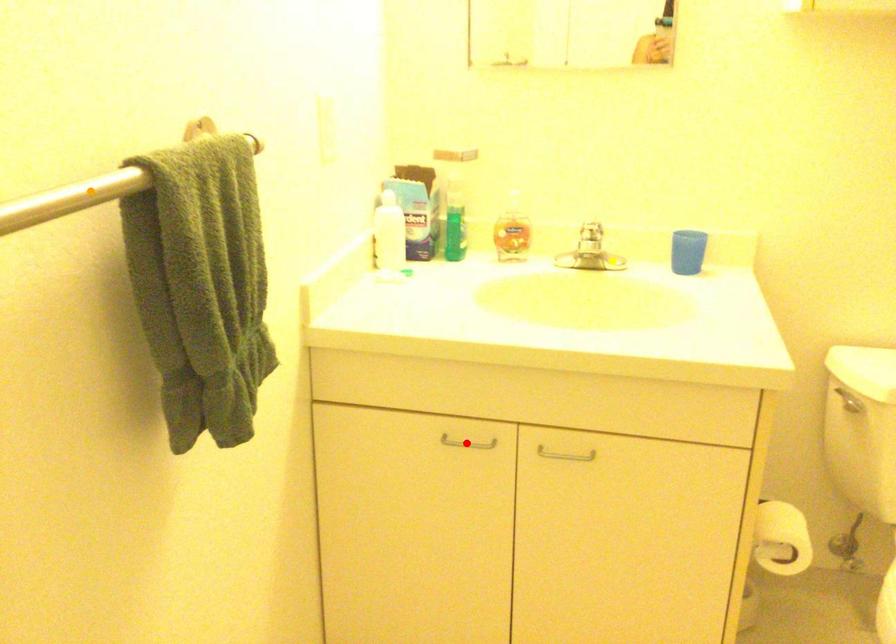
Based on the photo, order these from nearest to farthest:
A) yellow point
B) orange point
C) red point

orange point, red point, yellow point